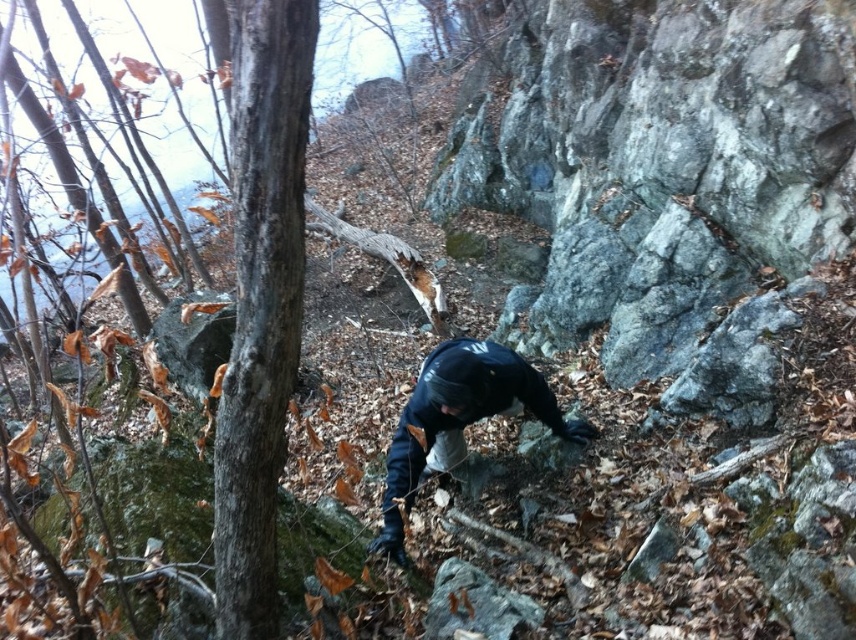
Question: Based on their relative distances, which object is farther from the smooth bark tree at center?

Choices:
 (A) smooth brown bark at center
 (B) dark blue jacket at center

Answer: (B)

Question: Can you confirm if smooth brown bark at center is wider than dark blue jacket at center?

Choices:
 (A) no
 (B) yes

Answer: (A)

Question: Considering the real-world distances, which object is closest to the smooth brown bark at center?

Choices:
 (A) smooth bark tree at center
 (B) dark blue jacket at center

Answer: (A)

Question: Based on their relative distances, which object is nearer to the smooth brown bark at center?

Choices:
 (A) smooth bark tree at center
 (B) dark blue jacket at center

Answer: (A)

Question: In this image, where is smooth brown bark at center located relative to smooth bark tree at center?

Choices:
 (A) left
 (B) right

Answer: (A)

Question: Can you confirm if smooth brown bark at center is positioned to the right of smooth bark tree at center?

Choices:
 (A) yes
 (B) no

Answer: (B)